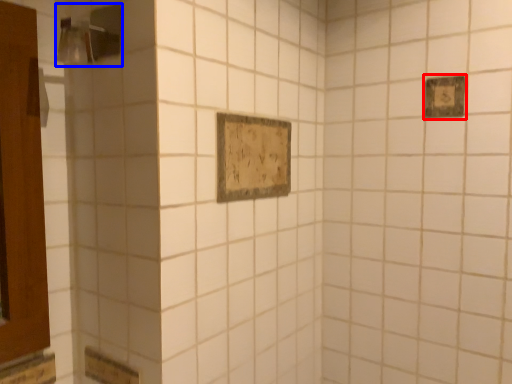
Question: Which object is closer to the camera taking this photo, rectangle (highlighted by a red box) or shower (highlighted by a blue box)?

Choices:
 (A) rectangle
 (B) shower

Answer: (B)